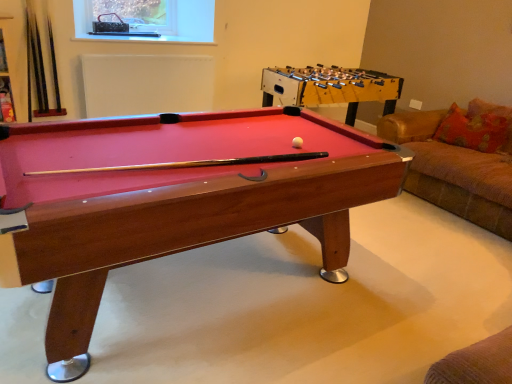
Question: Can you confirm if wooden foosball table at center is thinner than metallic mesh at upper center?

Choices:
 (A) no
 (B) yes

Answer: (A)

Question: Does wooden foosball table at center appear on the right side of metallic mesh at upper center?

Choices:
 (A) yes
 (B) no

Answer: (A)

Question: Considering the relative sizes of wooden foosball table at center and metallic mesh at upper center in the image provided, is wooden foosball table at center shorter than metallic mesh at upper center?

Choices:
 (A) yes
 (B) no

Answer: (B)

Question: Does wooden foosball table at center lie behind metallic mesh at upper center?

Choices:
 (A) yes
 (B) no

Answer: (B)

Question: From the image's perspective, is wooden foosball table at center beneath metallic mesh at upper center?

Choices:
 (A) yes
 (B) no

Answer: (A)

Question: Visually, is wooden billiard table at center positioned to the left or to the right of orange fabric pillow at right?

Choices:
 (A) left
 (B) right

Answer: (A)

Question: From a real-world perspective, relative to orange fabric pillow at right, is wooden billiard table at center vertically above or below?

Choices:
 (A) below
 (B) above

Answer: (A)

Question: Do you think wooden billiard table at center is within orange fabric pillow at right, or outside of it?

Choices:
 (A) inside
 (B) outside

Answer: (B)

Question: Looking at their shapes, would you say wooden billiard table at center is wider or thinner than orange fabric pillow at right?

Choices:
 (A) thin
 (B) wide

Answer: (B)

Question: From their relative heights in the image, would you say white matte ball at center is taller or shorter than metallic mesh at upper center?

Choices:
 (A) short
 (B) tall

Answer: (A)

Question: Is point (292, 142) positioned closer to the camera than point (129, 1)?

Choices:
 (A) farther
 (B) closer

Answer: (B)

Question: In terms of size, does white matte ball at center appear bigger or smaller than metallic mesh at upper center?

Choices:
 (A) small
 (B) big

Answer: (A)

Question: Is white matte ball at center to the left or to the right of metallic mesh at upper center in the image?

Choices:
 (A) right
 (B) left

Answer: (A)

Question: Considering their positions, is metallic mesh at upper center located in front of or behind wooden foosball table at center?

Choices:
 (A) behind
 (B) front

Answer: (A)

Question: From a real-world perspective, relative to wooden foosball table at center, is metallic mesh at upper center vertically above or below?

Choices:
 (A) above
 (B) below

Answer: (A)